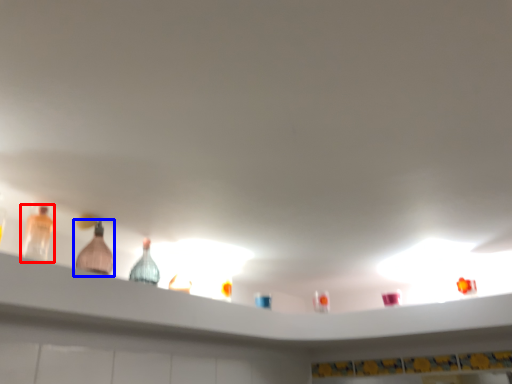
Question: Which of the following is the closest to the observer, bottle (highlighted by a red box) or bottle (highlighted by a blue box)?

Choices:
 (A) bottle
 (B) bottle

Answer: (A)